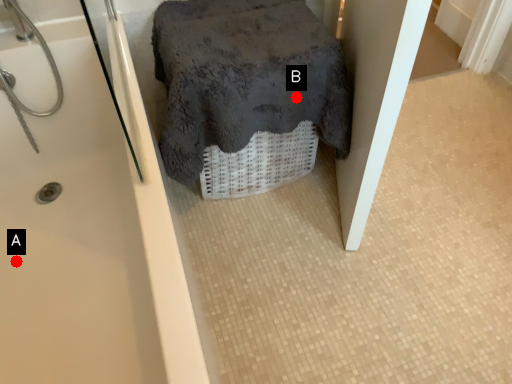
Question: Two points are circled on the image, labeled by A and B beside each circle. Which point is closer to the camera taking this photo?

Choices:
 (A) A is closer
 (B) B is closer

Answer: (A)